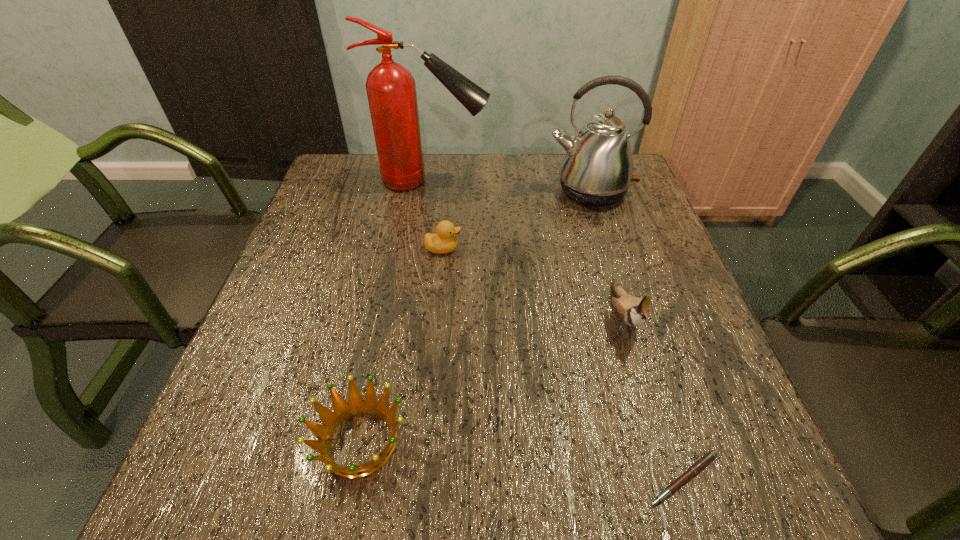
Where is `vacant space located facing forward on the duckling`? The image size is (960, 540). vacant space located facing forward on the duckling is located at coordinates (503, 248).

You are a GUI agent. You are given a task and a screenshot of the screen. Output one action in this format:
    pyautogui.click(x=<x>, y=<y>)
    Task: Click on the vacant space situated 0.400m on the right of the crown
    
    Given the screenshot: What is the action you would take?
    pyautogui.click(x=654, y=441)

The image size is (960, 540). I want to click on fire extinguisher that is positioned at the far edge, so click(391, 89).

I want to click on kettle located in the far edge section of the desktop, so click(597, 170).

Find the location of a particular element. crown at the near edge is located at coordinates coord(356,405).

The width and height of the screenshot is (960, 540). In order to click on pen situated at the near edge in this screenshot , I will do `click(706, 459)`.

Identify the location of object situated at the left edge. The height and width of the screenshot is (540, 960). (391, 89).

At what (x,y) coordinates should I click in order to perform the action: click on kettle that is positioned at the right edge. Please return your answer as a coordinate pair (x, y). The width and height of the screenshot is (960, 540). Looking at the image, I should click on (597, 170).

Where is `bird that is at the right edge`? The height and width of the screenshot is (540, 960). bird that is at the right edge is located at coordinates (634, 311).

This screenshot has width=960, height=540. I want to click on pen located in the right edge section of the desktop, so click(x=706, y=459).